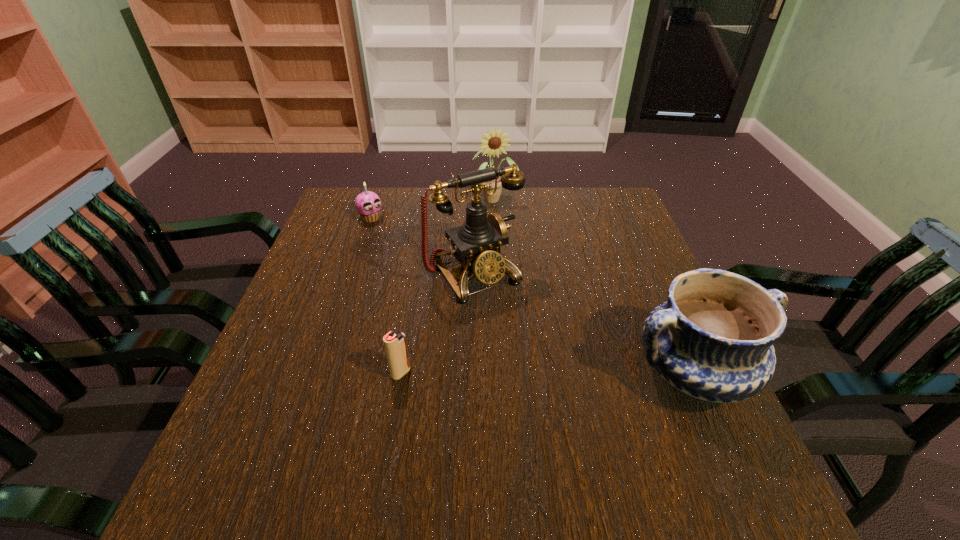
Where is `vacant space in between the igniter and the telephone`? This screenshot has height=540, width=960. vacant space in between the igniter and the telephone is located at coordinates (438, 324).

Where is `free area in between the igniter and the sunflower`? The width and height of the screenshot is (960, 540). free area in between the igniter and the sunflower is located at coordinates (447, 286).

Identify the location of vacant space in between the farthest object and the leftmost object. (433, 208).

You are a GUI agent. You are given a task and a screenshot of the screen. Output one action in this format:
    pyautogui.click(x=<x>, y=<y>)
    Task: Click on the vacant point located between the rightmost object and the farthest object
    The width and height of the screenshot is (960, 540).
    Given the screenshot: What is the action you would take?
    pyautogui.click(x=593, y=285)

Choose which object is the second nearest neighbor to the third shortest object. Please provide its 2D coordinates. Your answer should be formatted as a tuple, i.e. [(x, y)], where the tuple contains the x and y coordinates of a point satisfying the conditions above.

[(395, 345)]

Where is `object that stands as the fourth closest to the rightmost object`? The image size is (960, 540). object that stands as the fourth closest to the rightmost object is located at coordinates (368, 204).

The image size is (960, 540). I want to click on vacant position in the image that satisfies the following two spatial constraints: 1. on the front side of the telephone; 2. on the right side of the rightmost object, so click(472, 373).

Locate an element on the screen. This screenshot has height=540, width=960. vacant area that satisfies the following two spatial constraints: 1. on the front side of the third shortest object; 2. on the left side of the tallest object is located at coordinates (472, 373).